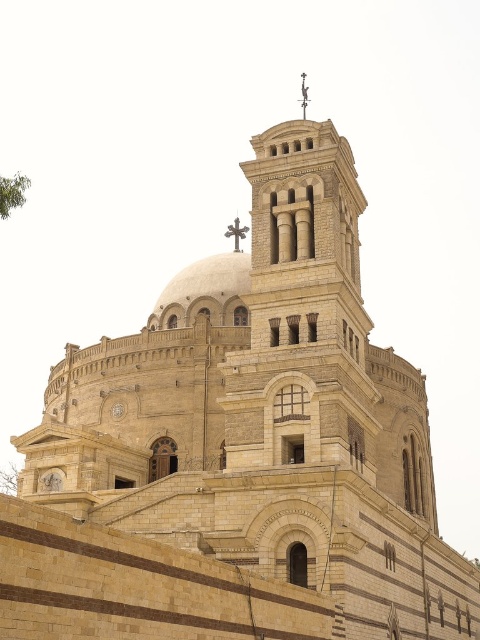
You are standing in front of the grand architectural structure described. Where is the beige stone dome at center located in the image?

The beige stone dome at center is located at the center of the image, specifically at coordinates approximately 0.441 on the x and 0.429 on the y axis.

You are standing at a certain distance from the beige stone dome at center. If the recommended safe viewing distance for the dome is 80 meters, is your current position considered safe?

The distance between you and the beige stone dome at center is 78.26 meters, which is less than the recommended 80 meters. Therefore, your current position is not considered safe.